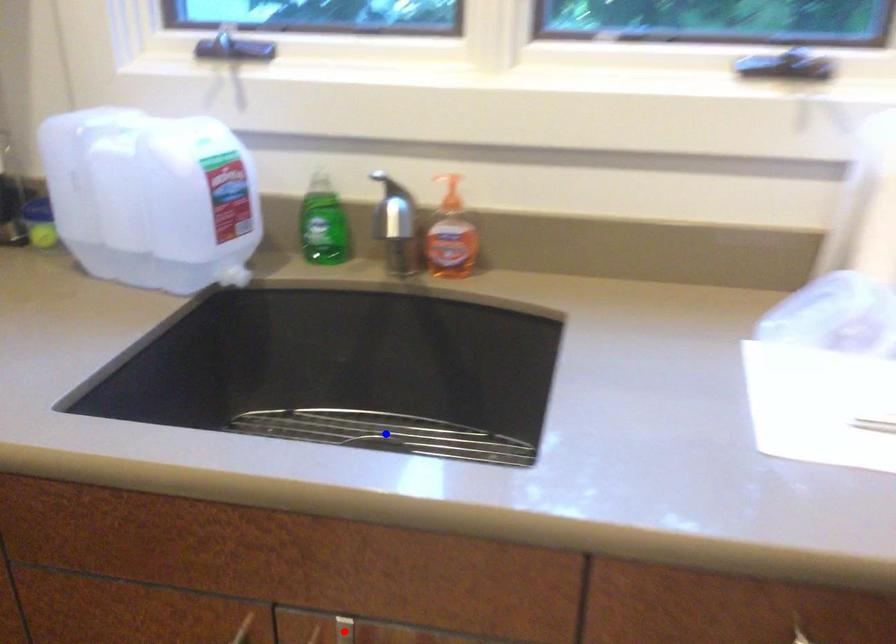
Question: Two points are marked on the image. Which point is closer to the camera?

Choices:
 (A) Blue point is closer.
 (B) Red point is closer.

Answer: (B)